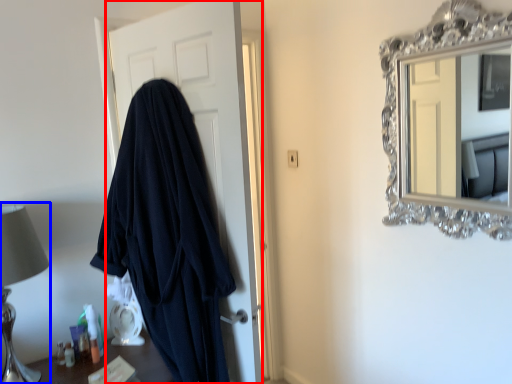
Question: Which of the following is the closest to the observer, door (highlighted by a red box) or table lamp (highlighted by a blue box)?

Choices:
 (A) door
 (B) table lamp

Answer: (A)